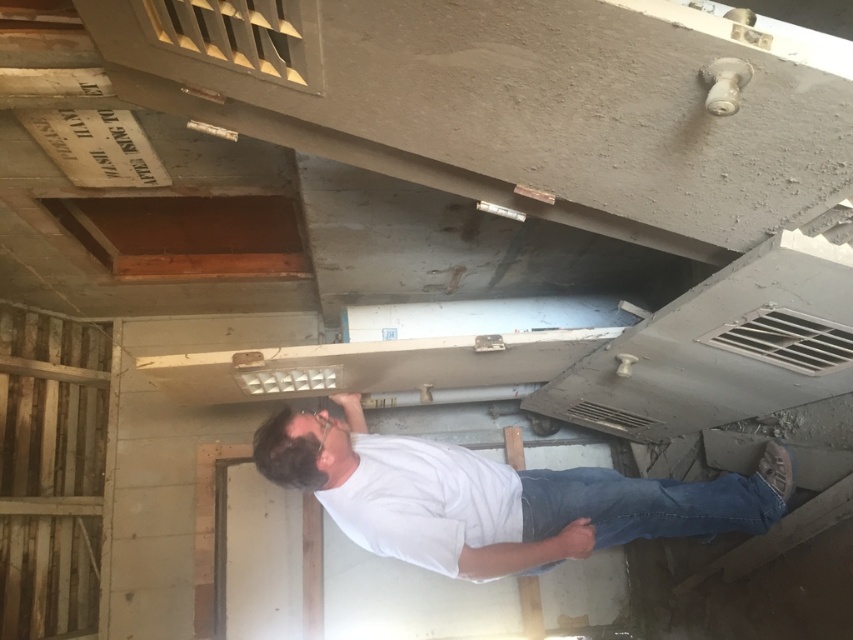
Does white matte shirt at center have a lesser height compared to blue denim jeans at lower center?

No.

Consider the image. Who is taller, white matte shirt at center or blue denim jeans at lower center?

white matte shirt at center is taller.

Is point (512, 538) in front of point (596, 531)?

Yes.

Find the location of `white matte shirt at center`. white matte shirt at center is located at coordinates (492, 497).